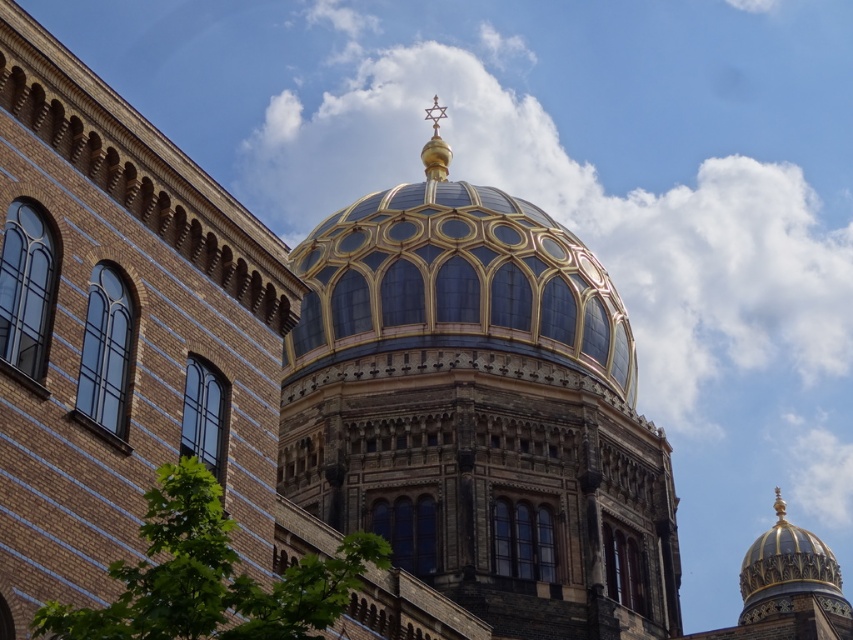
Based on the photo, you are an architect analyzing the symmetry of the building. The gold gilded dome is marked at point (479, 410). Is this point the exact center of the dome?

The gold gilded dome at center is represented by point (479, 410), so yes, this point is the exact center of the dome.